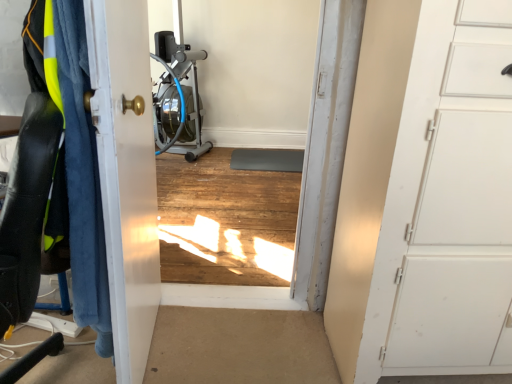
Question: Would you say blue fuzzy blanket at left contains matte black swivel chair at left?

Choices:
 (A) no
 (B) yes

Answer: (A)

Question: Is blue fuzzy blanket at left shorter than matte black swivel chair at left?

Choices:
 (A) no
 (B) yes

Answer: (A)

Question: Is blue fuzzy blanket at left aimed at matte black swivel chair at left?

Choices:
 (A) no
 (B) yes

Answer: (B)

Question: Can you confirm if blue fuzzy blanket at left is wider than matte black swivel chair at left?

Choices:
 (A) no
 (B) yes

Answer: (A)

Question: Is blue fuzzy blanket at left behind matte black swivel chair at left?

Choices:
 (A) yes
 (B) no

Answer: (A)

Question: From a real-world perspective, is matte black swivel chair at left positioned above or below white matte door at right, which is counted as the second door, starting from the left?

Choices:
 (A) above
 (B) below

Answer: (B)

Question: In terms of height, does matte black swivel chair at left look taller or shorter compared to white matte door at right, which is counted as the second door, starting from the left?

Choices:
 (A) tall
 (B) short

Answer: (B)

Question: From the image's perspective, is matte black swivel chair at left positioned above or below white matte door at right, which is counted as the second door, starting from the left?

Choices:
 (A) below
 (B) above

Answer: (A)

Question: Is point (31, 261) positioned closer to the camera than point (430, 172)?

Choices:
 (A) farther
 (B) closer

Answer: (B)

Question: Considering the positions of metallic silver rowing machine at center and blue fuzzy blanket at left in the image, is metallic silver rowing machine at center taller or shorter than blue fuzzy blanket at left?

Choices:
 (A) short
 (B) tall

Answer: (B)

Question: Is metallic silver rowing machine at center to the left or to the right of blue fuzzy blanket at left in the image?

Choices:
 (A) left
 (B) right

Answer: (A)

Question: From a real-world perspective, is metallic silver rowing machine at center above or below blue fuzzy blanket at left?

Choices:
 (A) above
 (B) below

Answer: (B)

Question: Considering the positions of metallic silver rowing machine at center and blue fuzzy blanket at left in the image, is metallic silver rowing machine at center wider or thinner than blue fuzzy blanket at left?

Choices:
 (A) wide
 (B) thin

Answer: (A)

Question: Is white glossy door at left, which appears as the 1th door when viewed from the left, wider or thinner than matte black swivel chair at left?

Choices:
 (A) thin
 (B) wide

Answer: (A)

Question: In terms of size, does white glossy door at left, arranged as the second door when viewed from the right, appear bigger or smaller than matte black swivel chair at left?

Choices:
 (A) small
 (B) big

Answer: (A)